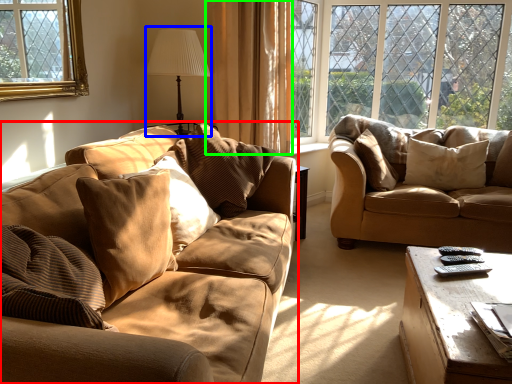
Question: Which is farther away from studio couch (highlighted by a red box)? table lamp (highlighted by a blue box) or curtain (highlighted by a green box)?

Choices:
 (A) table lamp
 (B) curtain

Answer: (A)